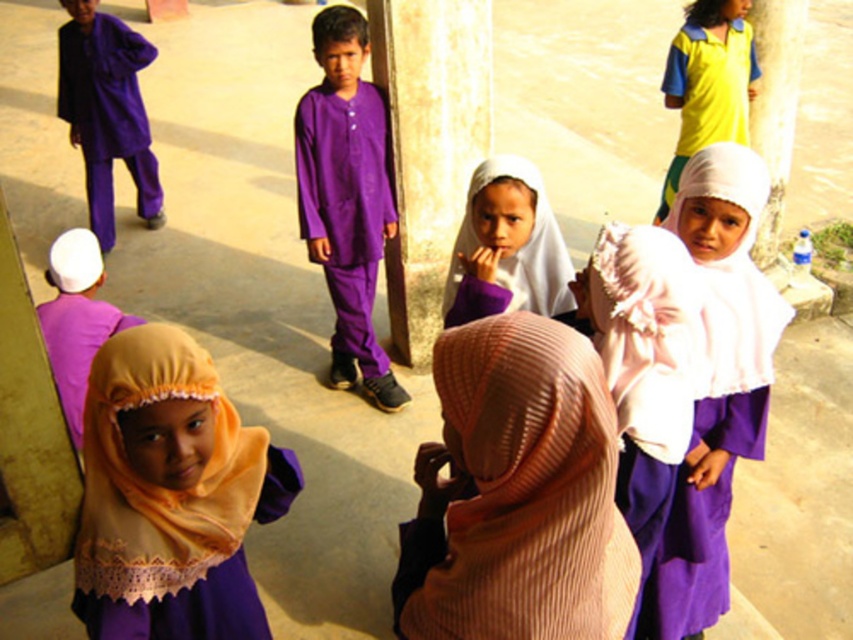
Between white matte hijab at center and purple matte robe at upper left, which one appears on the right side from the viewer's perspective?

Positioned to the right is white matte hijab at center.

Measure the distance between white matte hijab at center and purple matte robe at upper left.

The distance of white matte hijab at center from purple matte robe at upper left is 4.90 meters.

Locate an element on the screen. This screenshot has height=640, width=853. white matte hijab at center is located at coordinates (717, 388).

Locate an element on the screen. This screenshot has width=853, height=640. white matte hijab at center is located at coordinates (717, 388).

Which is in front, point (572, 465) or point (467, 88)?

Positioned in front is point (572, 465).

Does point (570, 397) come behind point (477, 54)?

That is False.

The image size is (853, 640). In order to click on pink striped hijab at center in this screenshot , I will do `click(517, 493)`.

Is white matte hijab at center shorter than white sheer hijab at center?

In fact, white matte hijab at center may be taller than white sheer hijab at center.

Who is positioned more to the left, white matte hijab at center or white sheer hijab at center?

white sheer hijab at center

Find the location of a particular element. This screenshot has height=640, width=853. white matte hijab at center is located at coordinates coord(717,388).

Locate an element on the screen. white matte hijab at center is located at coordinates (717, 388).